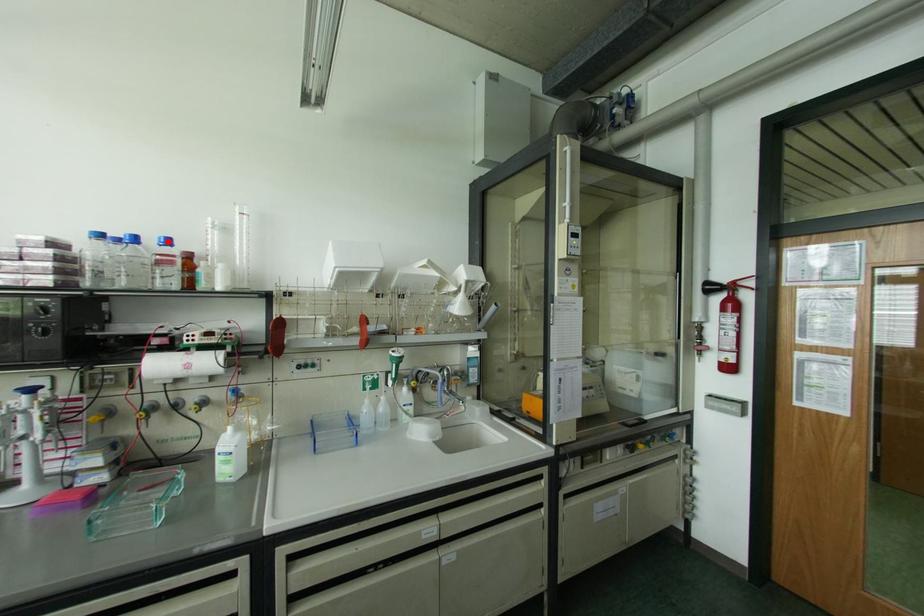
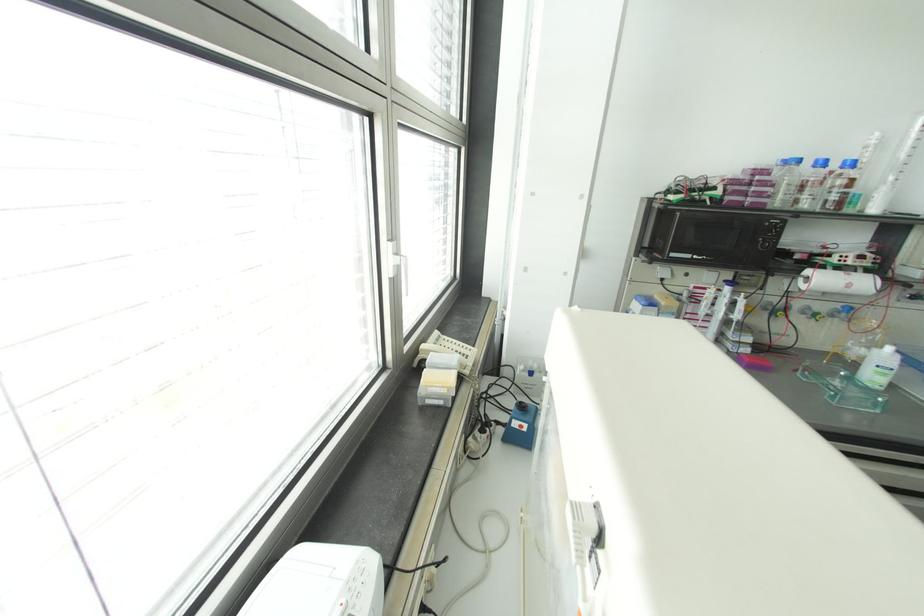
In the second image, find the point that corresponds to the highlighted location in the first image.

(852, 163)